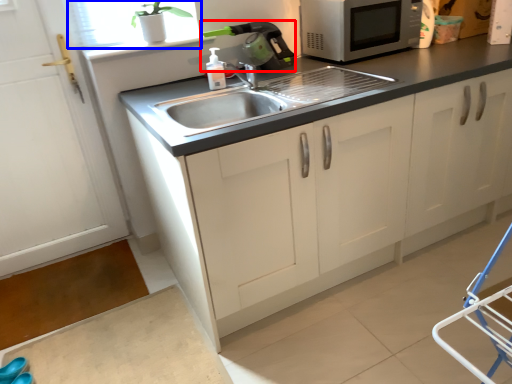
Question: Among these objects, which one is nearest to the camera, appliance (highlighted by a red box) or window screen (highlighted by a blue box)?

Choices:
 (A) appliance
 (B) window screen

Answer: (B)